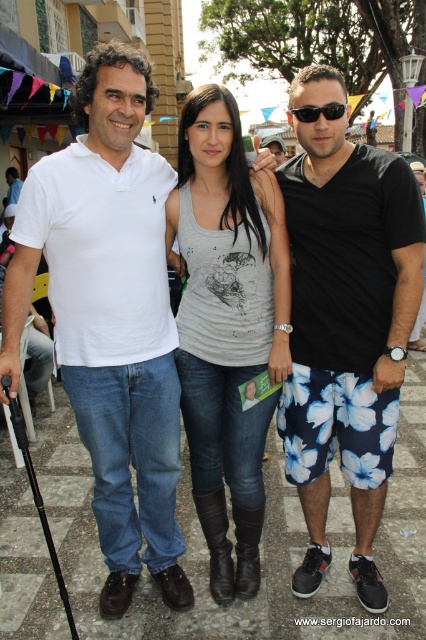
Is white cotton polo shirt at center shorter than black plastic sunglasses at center?

No.

Find the location of a particular element. This screenshot has height=640, width=426. white cotton polo shirt at center is located at coordinates (109, 316).

Is white cotton polo shirt at center wider than black cotton shorts at right?

Yes.

Does white cotton polo shirt at center appear over black cotton shorts at right?

Yes.

Describe the element at coordinates (109, 316) in the screenshot. The image size is (426, 640). I see `white cotton polo shirt at center` at that location.

This screenshot has height=640, width=426. I want to click on white cotton polo shirt at center, so click(x=109, y=316).

Between black cotton shorts at right and matte white polo shirt at left, which one is positioned lower?

black cotton shorts at right

Where is `black cotton shorts at right`? This screenshot has height=640, width=426. black cotton shorts at right is located at coordinates (347, 333).

Locate an element on the screen. black cotton shorts at right is located at coordinates (347, 333).